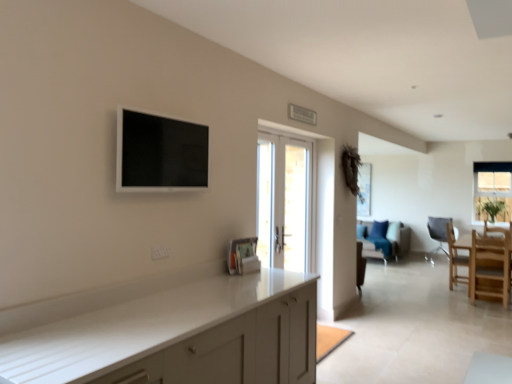
Question: Is velvet blue couch at center bigger or smaller than matte gray chair at right, which is the 1th chair from back to front?

Choices:
 (A) big
 (B) small

Answer: (A)

Question: Considering the positions of velvet blue couch at center and matte gray chair at right, marked as the third chair in a front-to-back arrangement, in the image, is velvet blue couch at center taller or shorter than matte gray chair at right, marked as the third chair in a front-to-back arrangement,?

Choices:
 (A) tall
 (B) short

Answer: (B)

Question: Estimate the real-world distances between objects in this image. Which object is farther from the light wood chair at lower right, the 1th chair from the front?

Choices:
 (A) velvet blue couch at center
 (B) matte black flat screen tv at upper left
 (C) white glossy door at center
 (D) wooden chair at right, the 2th chair from the back
 (E) clear glass window at upper right

Answer: (B)

Question: Which of these objects is positioned closest to the matte black flat screen tv at upper left?

Choices:
 (A) white glossy door at center
 (B) light wood chair at lower right, the 1th chair from the front
 (C) velvet blue couch at center
 (D) clear glass window at upper right
 (E) wooden chair at right, the 2th chair from the back

Answer: (A)